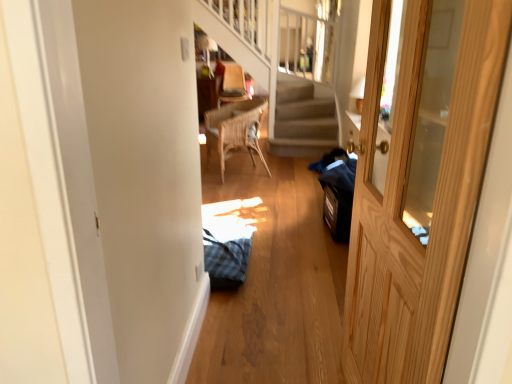
Question: Would you say wooden door at right is part of wooden woven armchair at upper center's contents?

Choices:
 (A) yes
 (B) no

Answer: (B)

Question: Does wooden woven armchair at upper center have a lesser width compared to wooden door at right?

Choices:
 (A) yes
 (B) no

Answer: (B)

Question: From the image's perspective, is wooden woven armchair at upper center above wooden door at right?

Choices:
 (A) yes
 (B) no

Answer: (A)

Question: Does wooden woven armchair at upper center lie in front of wooden door at right?

Choices:
 (A) yes
 (B) no

Answer: (B)

Question: Does wooden woven armchair at upper center have a smaller size compared to wooden door at right?

Choices:
 (A) no
 (B) yes

Answer: (A)

Question: Would you say wooden woven armchair at upper center is to the left or to the right of woven wood chair at center in the picture?

Choices:
 (A) left
 (B) right

Answer: (A)

Question: In terms of width, does wooden woven armchair at upper center look wider or thinner when compared to woven wood chair at center?

Choices:
 (A) thin
 (B) wide

Answer: (B)

Question: From a real-world perspective, relative to woven wood chair at center, is wooden woven armchair at upper center vertically above or below?

Choices:
 (A) below
 (B) above

Answer: (B)

Question: Is wooden woven armchair at upper center inside the boundaries of woven wood chair at center, or outside?

Choices:
 (A) inside
 (B) outside

Answer: (B)

Question: From a real-world perspective, is wooden door at right above or below wooden woven armchair at upper center?

Choices:
 (A) above
 (B) below

Answer: (A)

Question: From their relative heights in the image, would you say wooden door at right is taller or shorter than wooden woven armchair at upper center?

Choices:
 (A) tall
 (B) short

Answer: (A)

Question: Which is correct: wooden door at right is inside wooden woven armchair at upper center, or outside of it?

Choices:
 (A) outside
 (B) inside

Answer: (A)

Question: Is point (387, 36) positioned closer to the camera than point (225, 67)?

Choices:
 (A) closer
 (B) farther

Answer: (A)

Question: Considering the positions of point (251, 139) and point (422, 220), is point (251, 139) closer or farther from the camera than point (422, 220)?

Choices:
 (A) closer
 (B) farther

Answer: (B)

Question: Is woven wood chair at center inside or outside of wooden door at right?

Choices:
 (A) outside
 (B) inside

Answer: (A)